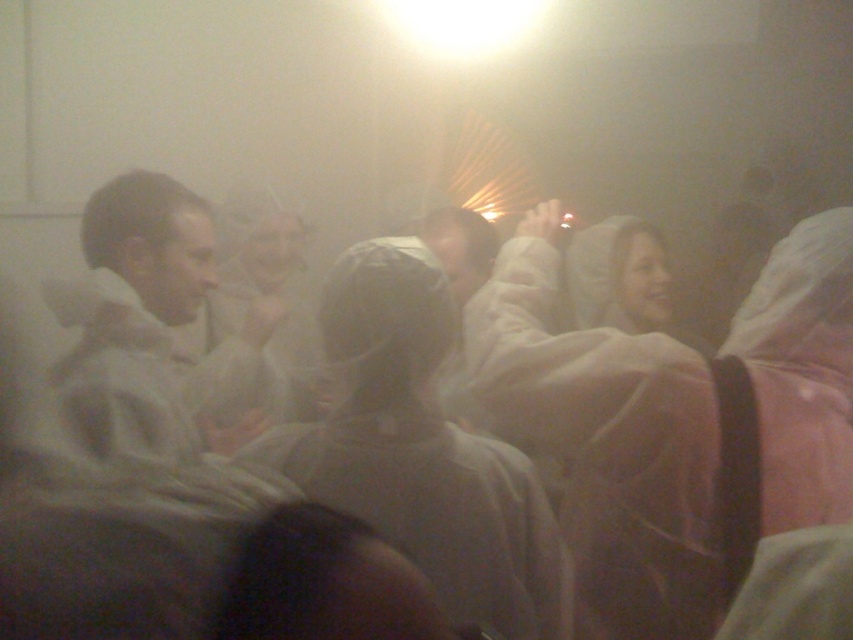
Question: Is white fabric at center above white matte jacket at center?

Choices:
 (A) yes
 (B) no

Answer: (B)

Question: Which of the following is the farthest from the observer?

Choices:
 (A) (360, 504)
 (B) (239, 321)
 (C) (120, 570)
 (D) (624, 259)

Answer: (D)

Question: Which of the following is the farthest from the observer?

Choices:
 (A) white plastic bag at center
 (B) smooth white coat at center
 (C) white matte jacket at center
 (D) white fabric at center

Answer: (B)

Question: In this image, where is white fabric at center located relative to white plastic bag at center?

Choices:
 (A) right
 (B) left

Answer: (A)

Question: Where is white fabric at center located in relation to white matte jacket at center in the image?

Choices:
 (A) left
 (B) right

Answer: (B)

Question: Which point appears farthest from the camera in this image?

Choices:
 (A) (444, 460)
 (B) (598, 278)
 (C) (786, 474)
 (D) (300, 250)

Answer: (D)